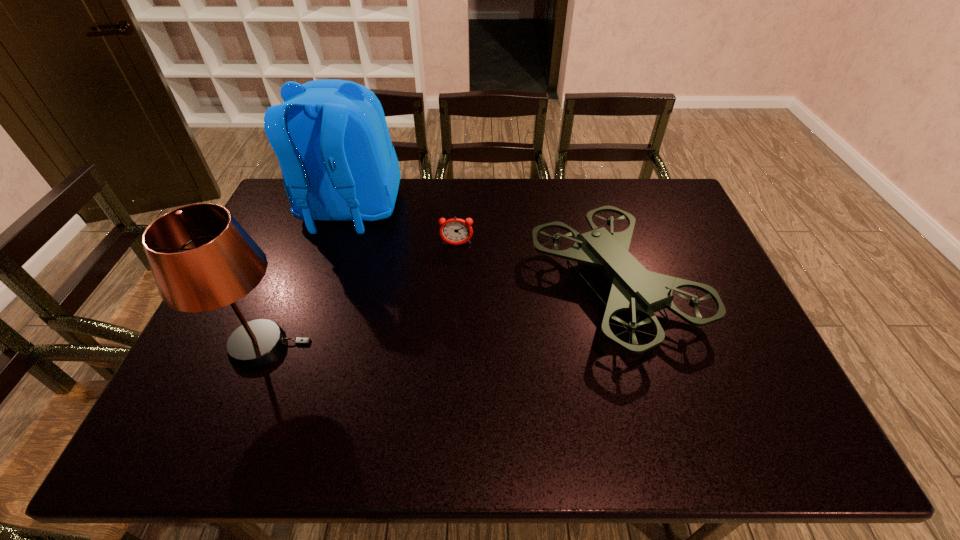
Find the location of `backpack`. backpack is located at coordinates (331, 138).

What are the coordinates of `lampshade` in the screenshot? It's located at (201, 258).

This screenshot has height=540, width=960. Find the location of `the third tallest object`. the third tallest object is located at coordinates (634, 288).

This screenshot has width=960, height=540. I want to click on the rightmost object, so click(634, 288).

You are a GUI agent. You are given a task and a screenshot of the screen. Output one action in this format:
    pyautogui.click(x=<x>, y=<y>)
    Task: Click on the shortest object
    The height and width of the screenshot is (540, 960).
    Given the screenshot: What is the action you would take?
    pyautogui.click(x=456, y=231)

Locate an element on the screen. This screenshot has height=540, width=960. alarm clock is located at coordinates (456, 231).

What are the coordinates of `free space located 0.090m on the back of the backpack` in the screenshot? It's located at (x=330, y=268).

Where is `vacant space located on the front-facing side of the lampshade`? This screenshot has width=960, height=540. vacant space located on the front-facing side of the lampshade is located at coordinates (337, 346).

Locate an element on the screen. The image size is (960, 540). free space located 0.070m on the front of the rightmost object is located at coordinates (646, 397).

Locate an element on the screen. This screenshot has width=960, height=540. vacant region located 0.050m on the front-facing side of the second object from right to left is located at coordinates (456, 258).